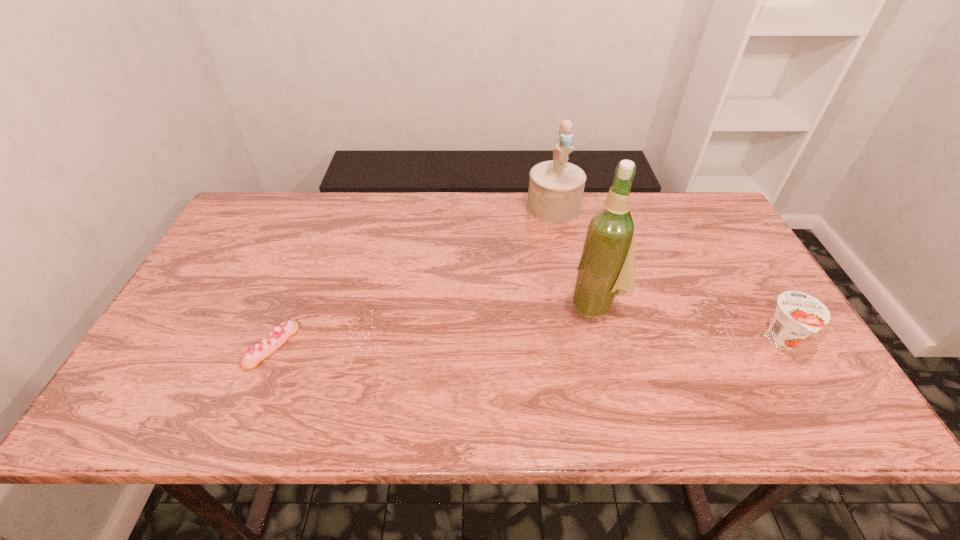
This screenshot has width=960, height=540. Find the location of `eclair`. eclair is located at coordinates (271, 343).

The image size is (960, 540). In order to click on the shortest object in this screenshot , I will do `click(271, 343)`.

This screenshot has width=960, height=540. I want to click on the rightmost object, so click(x=797, y=314).

Image resolution: width=960 pixels, height=540 pixels. I want to click on yogurt, so click(x=797, y=314).

I want to click on wine bottle, so click(x=606, y=269).

Identify the location of figurine. (556, 187).

Find the location of `the second tallest object`. the second tallest object is located at coordinates (556, 187).

Image resolution: width=960 pixels, height=540 pixels. I want to click on free space located 0.290m on the back of the shortest object, so click(312, 247).

The height and width of the screenshot is (540, 960). What are the coordinates of `free location located 0.100m on the left of the second shortest object` in the screenshot? It's located at (718, 341).

You are a GUI agent. You are given a task and a screenshot of the screen. Output one action in this format:
    pyautogui.click(x=<x>, y=<y>)
    Task: Click on the vacant space located 0.190m on the front-facing side of the tallest object
    
    Given the screenshot: What is the action you would take?
    pyautogui.click(x=516, y=350)